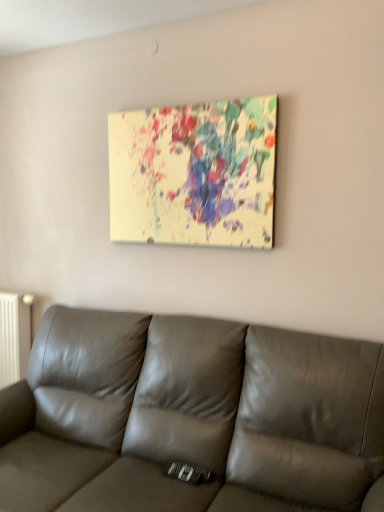
Question: Can you confirm if painted canvas at upper center is wider than white matte radiator at left?

Choices:
 (A) yes
 (B) no

Answer: (B)

Question: Can you confirm if painted canvas at upper center is smaller than white matte radiator at left?

Choices:
 (A) yes
 (B) no

Answer: (A)

Question: Considering the relative sizes of painted canvas at upper center and white matte radiator at left in the image provided, is painted canvas at upper center bigger than white matte radiator at left?

Choices:
 (A) yes
 (B) no

Answer: (B)

Question: From a real-world perspective, does painted canvas at upper center sit lower than white matte radiator at left?

Choices:
 (A) yes
 (B) no

Answer: (B)

Question: Considering the relative positions of painted canvas at upper center and white matte radiator at left in the image provided, is painted canvas at upper center to the right of white matte radiator at left from the viewer's perspective?

Choices:
 (A) no
 (B) yes

Answer: (B)

Question: Is painted canvas at upper center wider or thinner than leather couch at center?

Choices:
 (A) wide
 (B) thin

Answer: (B)

Question: Is painted canvas at upper center taller or shorter than leather couch at center?

Choices:
 (A) tall
 (B) short

Answer: (B)

Question: In the image, is painted canvas at upper center positioned in front of or behind leather couch at center?

Choices:
 (A) front
 (B) behind

Answer: (B)

Question: From the image's perspective, is painted canvas at upper center above or below leather couch at center?

Choices:
 (A) below
 (B) above

Answer: (B)

Question: Does point (157, 373) appear closer or farther from the camera than point (142, 152)?

Choices:
 (A) closer
 (B) farther

Answer: (A)

Question: In terms of height, does leather couch at center look taller or shorter compared to painted canvas at upper center?

Choices:
 (A) short
 (B) tall

Answer: (B)

Question: From the image's perspective, relative to painted canvas at upper center, is leather couch at center above or below?

Choices:
 (A) below
 (B) above

Answer: (A)

Question: Is leather couch at center spatially inside painted canvas at upper center, or outside of it?

Choices:
 (A) outside
 (B) inside

Answer: (A)

Question: Relative to white matte radiator at left, is painted canvas at upper center in front or behind?

Choices:
 (A) behind
 (B) front

Answer: (B)

Question: Do you think painted canvas at upper center is within white matte radiator at left, or outside of it?

Choices:
 (A) inside
 (B) outside

Answer: (B)